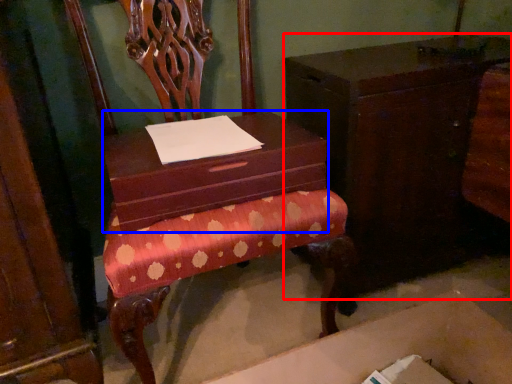
Question: Which object is closer to the camera taking this photo, furniture (highlighted by a red box) or shoe box (highlighted by a blue box)?

Choices:
 (A) furniture
 (B) shoe box

Answer: (B)